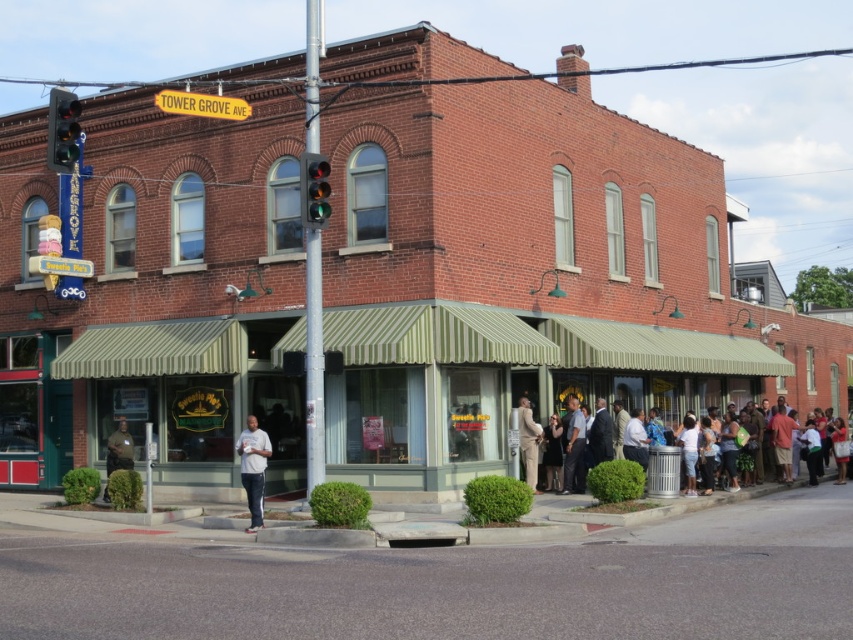
From the picture: You are a customer entering the Sweetie Pops store and see the dark gray suit at lower right and the tan fabric suit at center. Which suit is closer to the entrance?

The dark gray suit at lower right is closer to the entrance because it is shorter than the tan fabric suit at center, indicating it is positioned lower and nearer to the entrance area.

You are a customer entering the store through the entrance under the striped green and white awning. You see a dark gray suit at lower right and a tan fabric suit at center. Which suit is closer to you as you enter?

The dark gray suit at lower right is closer to you because the tan fabric suit at center is behind it.

You are a pedestrian standing in front of the building. You see the metallic pole at center and the green glass traffic light at upper left. Which object is more to the right from your perspective?

The metallic pole at center is positioned on the right side of the green glass traffic light at upper left, so it is more to the right.